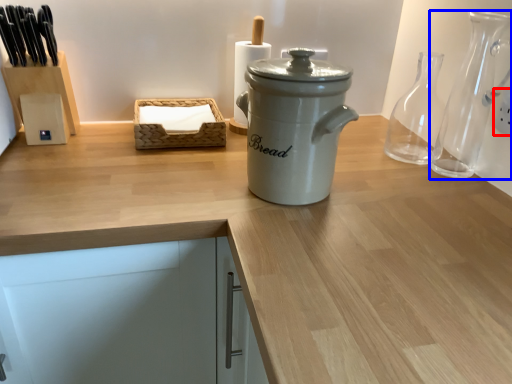
Question: Which point is further to the camera, electric outlet (highlighted by a red box) or glass vase (highlighted by a blue box)?

Choices:
 (A) electric outlet
 (B) glass vase

Answer: (A)